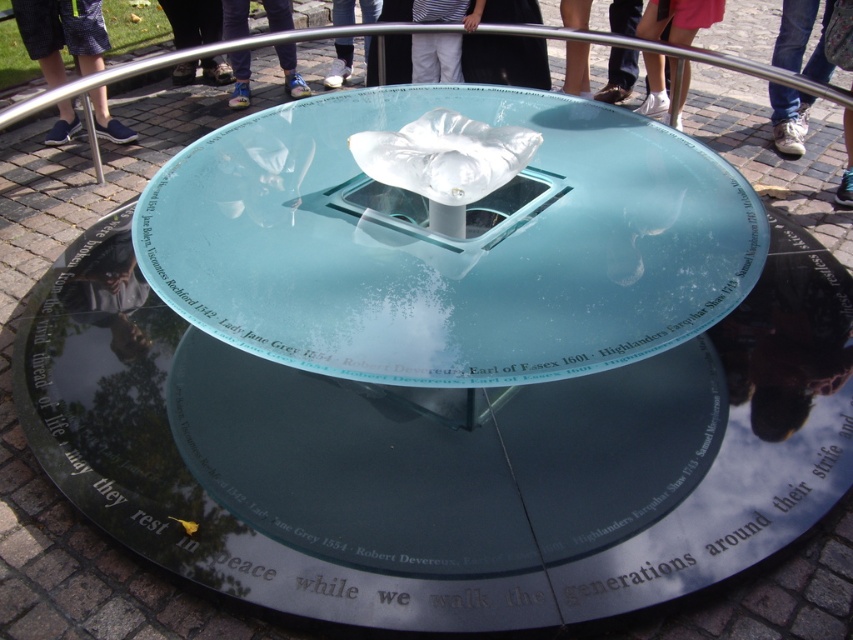
Question: Which object appears closest to the camera in this image?

Choices:
 (A) black fabric pants at center
 (B) white fabric shoe at lower center
 (C) blue denim shorts at left

Answer: (C)

Question: Does transparent glass table at center appear on the right side of black fabric pants at center?

Choices:
 (A) no
 (B) yes

Answer: (A)

Question: Does transparent glass table at center have a lesser width compared to blue fabric pants at center?

Choices:
 (A) yes
 (B) no

Answer: (B)

Question: Which point appears farthest from the camera in this image?

Choices:
 (A) pos(491,51)
 (B) pos(62,120)
 (C) pos(418,44)
 (D) pos(276,45)

Answer: (D)

Question: Estimate the real-world distances between objects in this image. Which object is farther from the transparent glass table at center?

Choices:
 (A) blue fabric pants at center
 (B) dark blue jeans at center

Answer: (B)

Question: Is the position of blue fabric pants at center less distant than that of white fabric shoe at lower center?

Choices:
 (A) yes
 (B) no

Answer: (B)